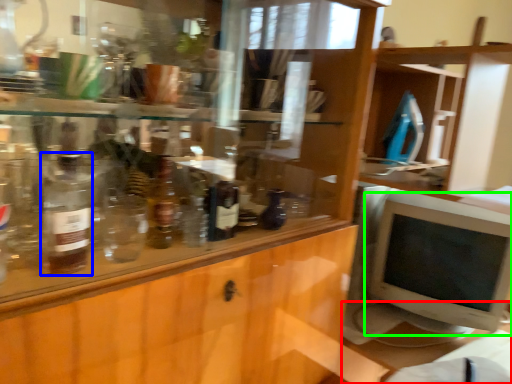
Question: Estimate the real-world distances between objects in this image. Which object is farther from table (highlighted by a red box), bottle (highlighted by a blue box) or computer monitor (highlighted by a green box)?

Choices:
 (A) bottle
 (B) computer monitor

Answer: (A)